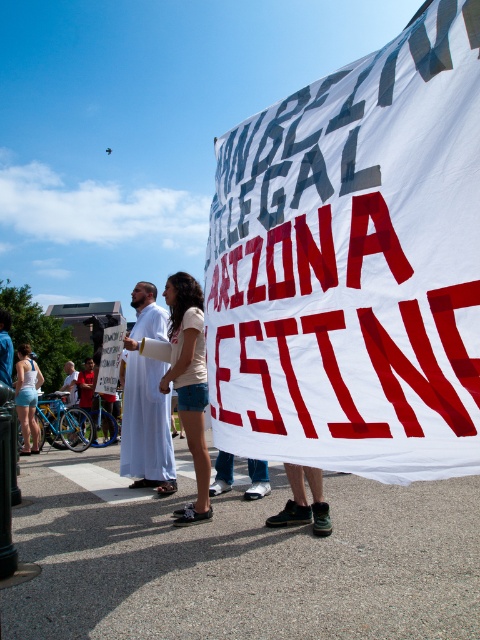
Question: Among these points, which one is nearest to the camera?

Choices:
 (A) (253, 445)
 (B) (204, 509)

Answer: (A)

Question: Is white fabric banner at center above matte white tank top at lower left?

Choices:
 (A) yes
 (B) no

Answer: (A)

Question: Which object appears closest to the camera in this image?

Choices:
 (A) matte white shirt at center
 (B) matte white tank top at lower left
 (C) white fabric banner at center

Answer: (C)

Question: Does white fabric banner at center have a greater width compared to matte white shirt at center?

Choices:
 (A) no
 (B) yes

Answer: (B)

Question: Which object is positioned closest to the matte white shirt at center?

Choices:
 (A) matte white tank top at lower left
 (B) white fabric banner at center

Answer: (B)

Question: In this image, where is white fabric banner at center located relative to matte white shirt at center?

Choices:
 (A) below
 (B) above

Answer: (B)